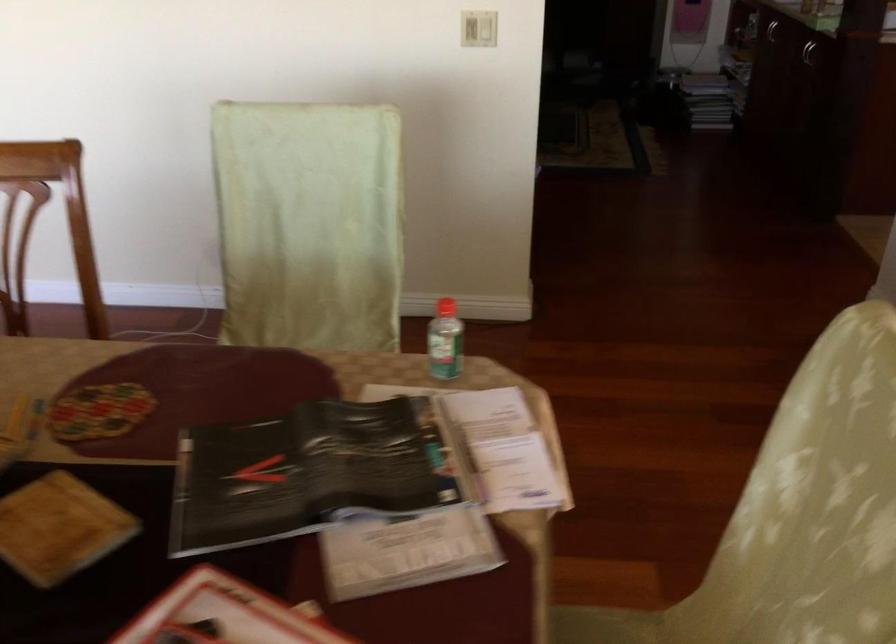
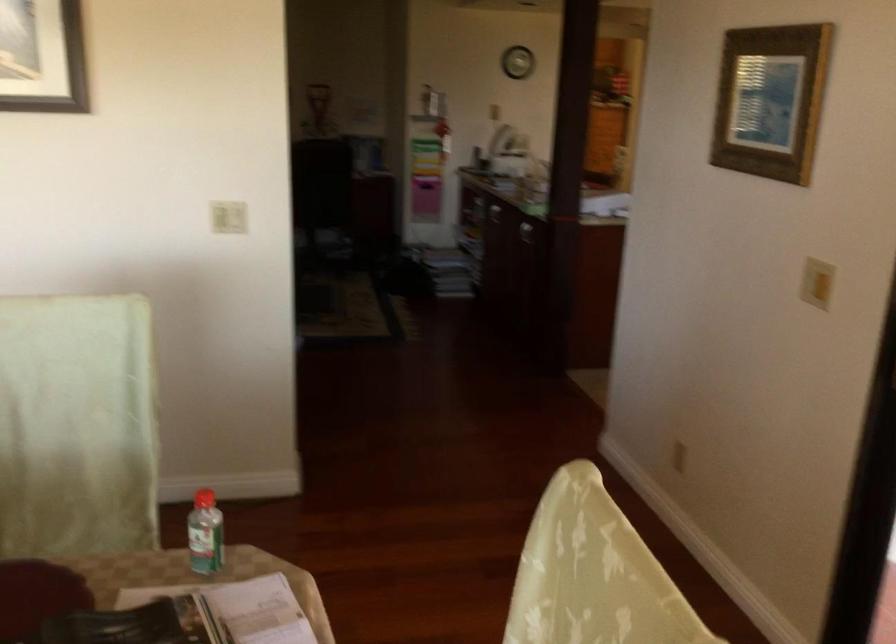
Question: The images are taken continuously from a first-person perspective. In which direction are you moving?

Choices:
 (A) Left
 (B) Right
 (C) Forward
 (D) Backward

Answer: (D)